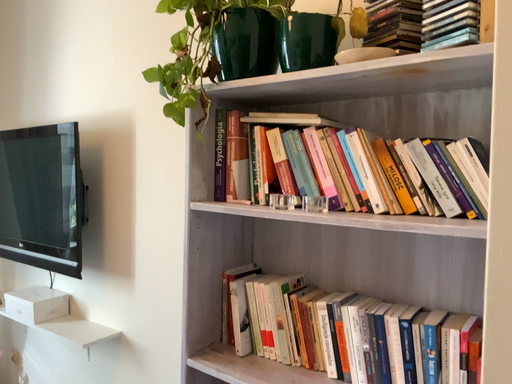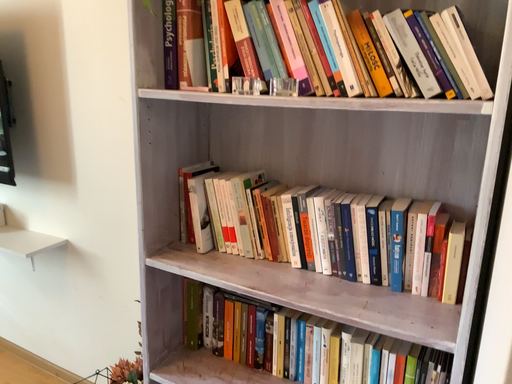
Question: Which way did the camera rotate in the video?

Choices:
 (A) rotated right
 (B) rotated left

Answer: (A)